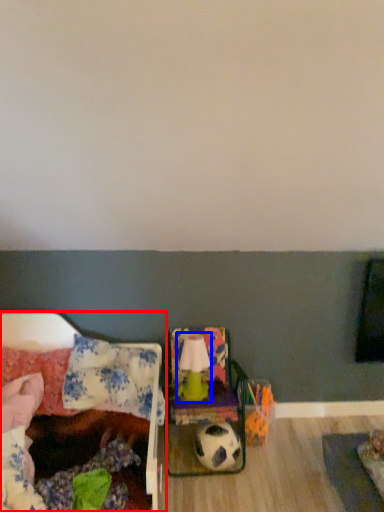
Question: Which object is further to the camera taking this photo, furniture (highlighted by a red box) or lamp (highlighted by a blue box)?

Choices:
 (A) furniture
 (B) lamp

Answer: (B)